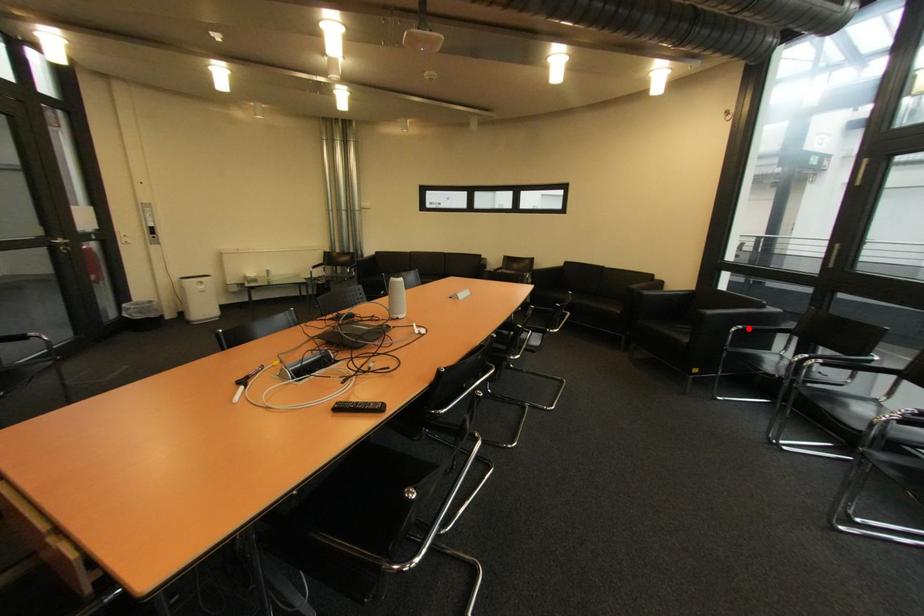
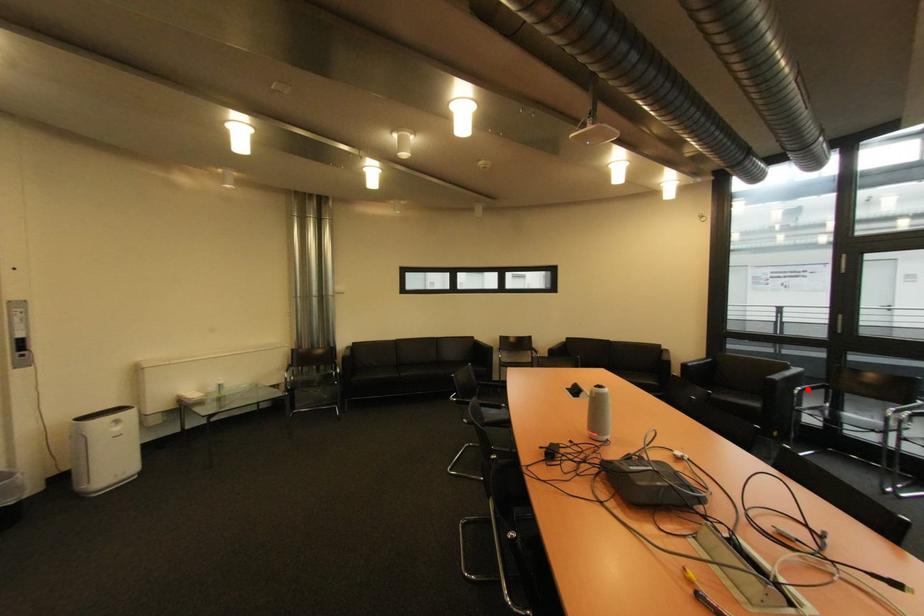
I am providing you with two images of the same scene from different viewpoints. A red point is marked on the first image and another point is marked on the second image. Are the points marked in image1 and image2 representing the same 3D position?

Yes